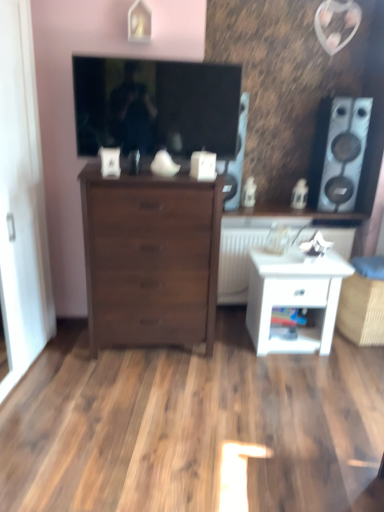
Question: From the image's perspective, is white glossy nightstand at lower right located above dark wood chest of drawers at center?

Choices:
 (A) yes
 (B) no

Answer: (B)

Question: Considering the relative sizes of white glossy nightstand at lower right and dark wood chest of drawers at center in the image provided, is white glossy nightstand at lower right taller than dark wood chest of drawers at center?

Choices:
 (A) no
 (B) yes

Answer: (A)

Question: Is white glossy nightstand at lower right to the left of dark wood chest of drawers at center from the viewer's perspective?

Choices:
 (A) no
 (B) yes

Answer: (A)

Question: Is white glossy nightstand at lower right outside of dark wood chest of drawers at center?

Choices:
 (A) yes
 (B) no

Answer: (A)

Question: Is dark wood chest of drawers at center completely or partially inside white glossy nightstand at lower right?

Choices:
 (A) no
 (B) yes

Answer: (A)

Question: Does white glossy nightstand at lower right have a lesser width compared to dark wood chest of drawers at center?

Choices:
 (A) yes
 (B) no

Answer: (A)

Question: Can you confirm if white glossy nightstand at lower right is positioned to the left of wooden cabinet at center?

Choices:
 (A) yes
 (B) no

Answer: (A)

Question: Would you say white glossy nightstand at lower right is outside wooden cabinet at center?

Choices:
 (A) yes
 (B) no

Answer: (A)

Question: Is white glossy nightstand at lower right oriented towards wooden cabinet at center?

Choices:
 (A) yes
 (B) no

Answer: (B)

Question: From the image's perspective, does white glossy nightstand at lower right appear lower than wooden cabinet at center?

Choices:
 (A) yes
 (B) no

Answer: (A)

Question: From a real-world perspective, is white glossy nightstand at lower right located higher than wooden cabinet at center?

Choices:
 (A) no
 (B) yes

Answer: (A)

Question: Is white glossy nightstand at lower right positioned in front of wooden cabinet at center?

Choices:
 (A) yes
 (B) no

Answer: (A)

Question: Is matte black speaker at upper center, which is the second speaker in right-to-left order, positioned with its back to white matte radiator at center?

Choices:
 (A) no
 (B) yes

Answer: (A)